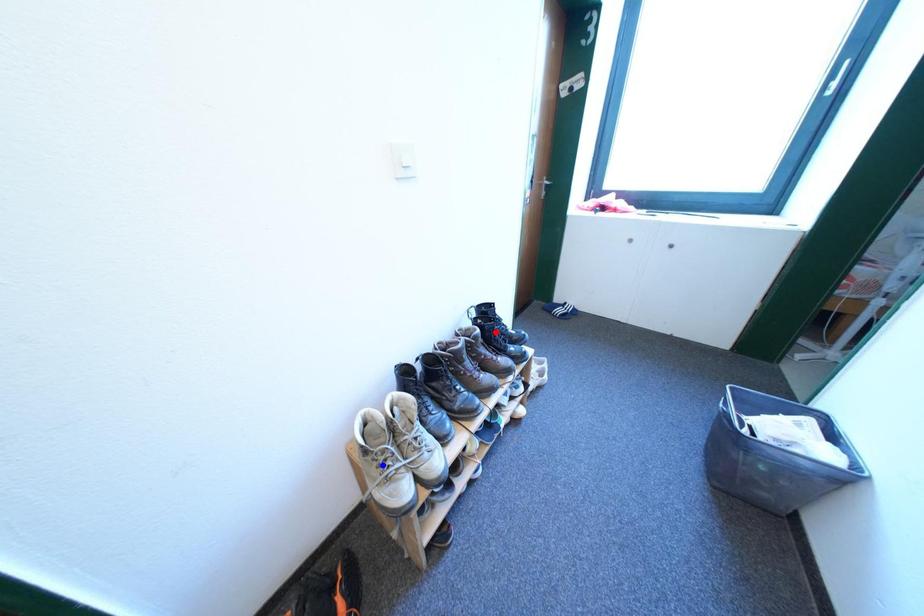
Question: Two points are marked on the image. Which point is closer to the camera?

Choices:
 (A) Blue point is closer.
 (B) Red point is closer.

Answer: (A)